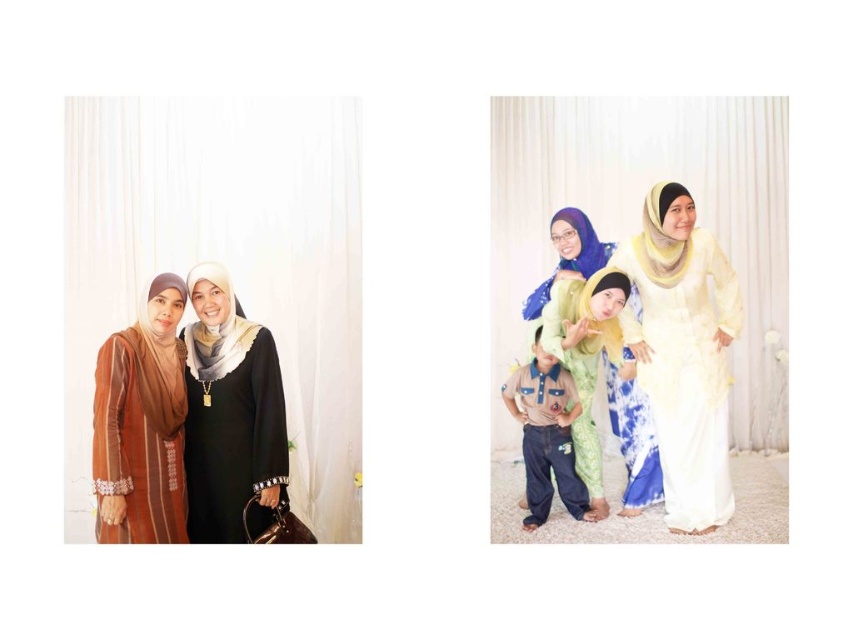
You are a photographer who needs to adjust the lighting for the left image. The blue satin shawl at center is currently 3.01 meters away from the camera. If you want to move the shawl closer to the camera to make it appear larger in the photo, how much distance should you reduce between the shawl and the camera?

To make the blue satin shawl at center appear larger in the photo, you should reduce the distance between it and the camera. Since the current distance is 3.01 meters, moving it closer by any amount would help, but the exact reduction needed depends on the desired size increase. However, the question doesn

You are a fashion designer observing the left image. You need to determine which item takes up more space in the photo between the matte brown dress at left and the white soft scarf at center. Which one is bigger?

The matte brown dress at left is larger in size compared to the white soft scarf at center, so the matte brown dress at left takes up more space in the photo.

In the left image, you are a photographer trying to adjust the lighting for the two women wearing a blue satin shawl at center and a white soft scarf at center. Which item is blocking the light from reaching the other?

The white soft scarf at center is behind the blue satin shawl at center, so the blue satin shawl at center is blocking the light from reaching the white soft scarf at center.